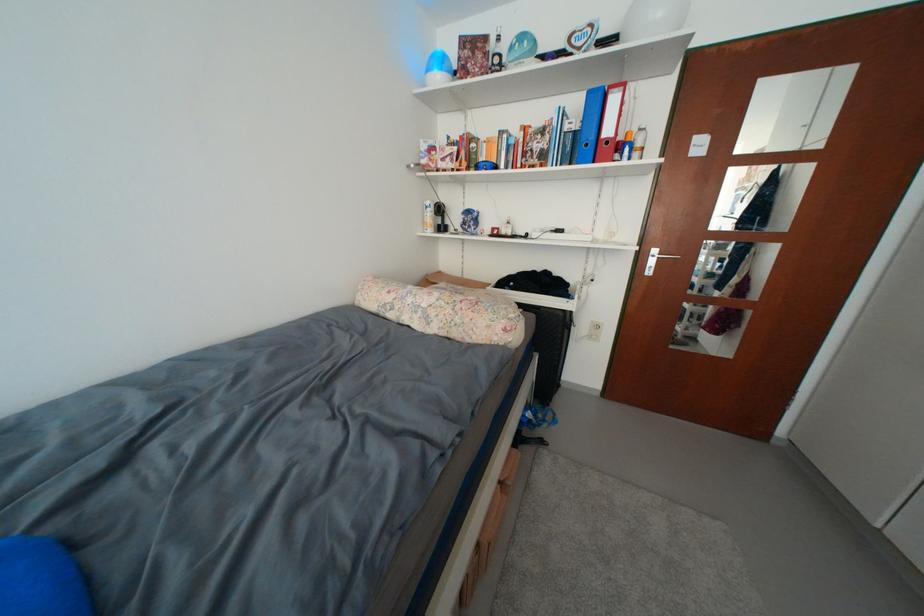
Where would you lift the floral bolster pillow? Please return your answer as a coordinate pair (x, y).

(444, 310)